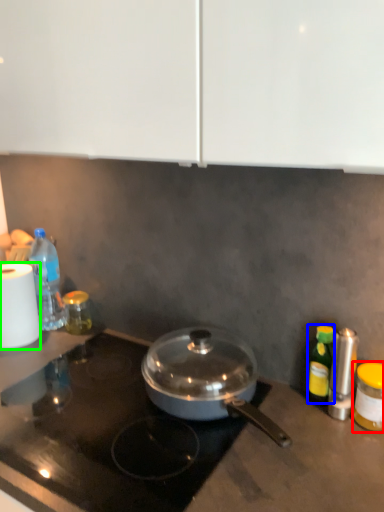
Question: Estimate the real-world distances between objects in this image. Which object is farther from bottle (highlighted by a red box), bottle (highlighted by a blue box) or paper towel (highlighted by a green box)?

Choices:
 (A) bottle
 (B) paper towel

Answer: (B)